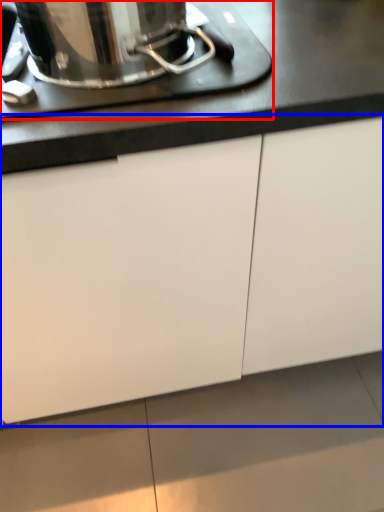
Question: Which of the following is the closest to the observer, home appliance (highlighted by a red box) or cabinetry (highlighted by a blue box)?

Choices:
 (A) home appliance
 (B) cabinetry

Answer: (B)